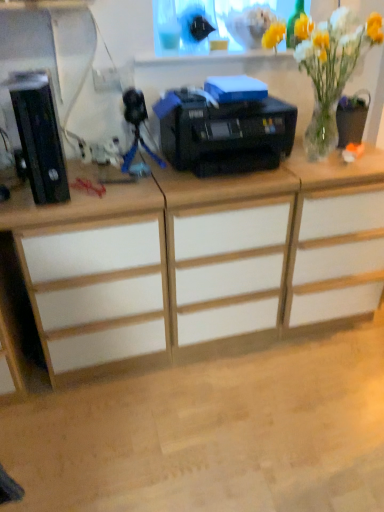
Identify the location of vacant area that lies to the right of black plastic computer tower at left. This screenshot has height=512, width=384. (100, 175).